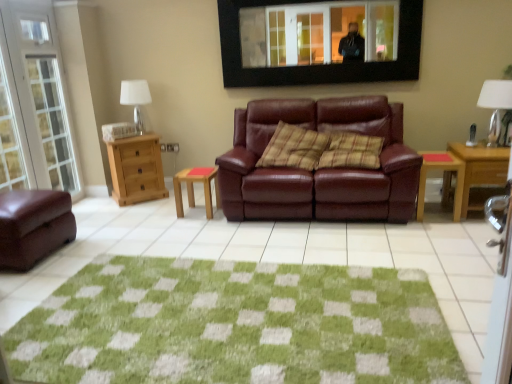
The height and width of the screenshot is (384, 512). Describe the element at coordinates (320, 169) in the screenshot. I see `matte leather couch at center, acting as the second studio couch starting from the left` at that location.

This screenshot has height=384, width=512. In order to click on wooden desk at right in this screenshot , I will do `click(480, 168)`.

Describe the element at coordinates (445, 172) in the screenshot. Image resolution: width=512 pixels, height=384 pixels. I see `wooden side table at right, the 2th table viewed from the left` at that location.

Measure the distance between point (26,245) and camera.

9.72 feet.

Where is `white fabric lampshade at upper right, the first lamp when ordered from right to left`? This screenshot has width=512, height=384. white fabric lampshade at upper right, the first lamp when ordered from right to left is located at coordinates (495, 104).

The height and width of the screenshot is (384, 512). I want to click on matte leather couch at center, which is the first studio couch from right to left, so click(x=320, y=169).

Measure the distance from white fabric lampshade at left, the second lamp viewed from the right, to wooden side table at right, the 2th table viewed from the left.

white fabric lampshade at left, the second lamp viewed from the right, and wooden side table at right, the 2th table viewed from the left, are 2.88 meters apart from each other.

From the image's perspective, starting from the white fabric lampshade at left, which is the first lamp from left to right, which table is the 1st one below? Please provide its 2D coordinates.

[(445, 172)]

From the image's perspective, would you say white fabric lampshade at left, arranged as the 1th lamp when viewed from the back, is positioned over wooden side table at right, which is counted as the 1th table, starting from the right?

Yes.

Looking at this image, from a real-world perspective, which object rests below the other?

wooden side table at right, the 2th table viewed from the left.

Which object is positioned more to the right, matte leather couch at center, acting as the second studio couch starting from the left, or matte brown leather ottoman at lower left, which appears as the first studio couch when viewed from the left?

matte leather couch at center, acting as the second studio couch starting from the left, is more to the right.

Consider the image. From the image's perspective, which one is positioned higher, matte leather couch at center, acting as the second studio couch starting from the left, or matte brown leather ottoman at lower left, which appears as the first studio couch when viewed from the left?

From the image's view, matte leather couch at center, acting as the second studio couch starting from the left, is above.

Between matte leather couch at center, which is the first studio couch from right to left, and matte brown leather ottoman at lower left, which appears as the first studio couch when viewed from the left, which one has less height?

With less height is matte brown leather ottoman at lower left, which appears as the first studio couch when viewed from the left.

From the picture: Considering the relative sizes of matte leather couch at center, which is the first studio couch from right to left, and matte brown leather ottoman at lower left, which appears as the first studio couch when viewed from the left, in the image provided, is matte leather couch at center, which is the first studio couch from right to left, smaller than matte brown leather ottoman at lower left, which appears as the first studio couch when viewed from the left,?

Actually, matte leather couch at center, which is the first studio couch from right to left, might be larger than matte brown leather ottoman at lower left, which appears as the first studio couch when viewed from the left.

In terms of height, does matte leather couch at center, acting as the second studio couch starting from the left, look taller or shorter compared to plaid fabric pillow at center?

Considering their sizes, matte leather couch at center, acting as the second studio couch starting from the left, has more height than plaid fabric pillow at center.

From the image's perspective, count 1st studio couchs downward from the plaid fabric pillow at center and point to it. Please provide its 2D coordinates.

[(320, 169)]

Between matte leather couch at center, which is the first studio couch from right to left, and plaid fabric pillow at center, which one appears on the right side from the viewer's perspective?

From the viewer's perspective, matte leather couch at center, which is the first studio couch from right to left, appears more on the right side.

Is matte leather couch at center, which is the first studio couch from right to left, oriented away from plaid fabric pillow at center?

Yes.

Which is in front, wooden stool at center, marked as the first table in a left-to-right arrangement, or matte brown leather ottoman at lower left, which appears as the first studio couch when viewed from the left?

matte brown leather ottoman at lower left, which appears as the first studio couch when viewed from the left, is in front.

Can we say wooden stool at center, the second table from the right, lies outside matte brown leather ottoman at lower left, arranged as the second studio couch when viewed from the right?

Yes, wooden stool at center, the second table from the right, is located beyond the bounds of matte brown leather ottoman at lower left, arranged as the second studio couch when viewed from the right.

Is wooden stool at center, marked as the first table in a left-to-right arrangement, far away from matte brown leather ottoman at lower left, arranged as the second studio couch when viewed from the right?

wooden stool at center, marked as the first table in a left-to-right arrangement, is far away from matte brown leather ottoman at lower left, arranged as the second studio couch when viewed from the right.

Is white fabric lampshade at upper right, the 1th lamp viewed from the front, positioned with its back to wooden stool at center, marked as the first table in a left-to-right arrangement?

No, wooden stool at center, marked as the first table in a left-to-right arrangement, is not at the back of white fabric lampshade at upper right, the 1th lamp viewed from the front.

Is white fabric lampshade at upper right, the 1th lamp viewed from the front, touching wooden stool at center, the second table from the right?

No, white fabric lampshade at upper right, the 1th lamp viewed from the front, is not making contact with wooden stool at center, the second table from the right.

Considering the relative sizes of white fabric lampshade at upper right, which appears as the 2th lamp when viewed from the back, and wooden stool at center, marked as the first table in a left-to-right arrangement, in the image provided, is white fabric lampshade at upper right, which appears as the 2th lamp when viewed from the back, wider than wooden stool at center, marked as the first table in a left-to-right arrangement,?

In fact, white fabric lampshade at upper right, which appears as the 2th lamp when viewed from the back, might be narrower than wooden stool at center, marked as the first table in a left-to-right arrangement.

Based on the photo, how different are the orientations of wooden desk at right and wooden side table at right, the 2th table viewed from the left, in degrees?

The angular difference between wooden desk at right and wooden side table at right, the 2th table viewed from the left, is 1.08 degrees.

Choose the correct answer: Is wooden desk at right inside wooden side table at right, which is counted as the 1th table, starting from the right, or outside it?

wooden desk at right is outside wooden side table at right, which is counted as the 1th table, starting from the right.

Which point is more forward, (507, 158) or (424, 157)?

The point (507, 158) is closer to the camera.

You are a GUI agent. You are given a task and a screenshot of the screen. Output one action in this format:
    pyautogui.click(x=<x>, y=<y>)
    Task: Click on the desk above the wooden side table at right, the 2th table viewed from the left (from the image's perspective)
    This screenshot has width=512, height=384.
    Given the screenshot: What is the action you would take?
    pyautogui.click(x=480, y=168)

Between matte leather couch at center, which is the first studio couch from right to left, and wooden desk at right, which one is positioned in front?

matte leather couch at center, which is the first studio couch from right to left, is closer to the camera.

Between matte leather couch at center, which is the first studio couch from right to left, and wooden desk at right, which one appears on the left side from the viewer's perspective?

From the viewer's perspective, matte leather couch at center, which is the first studio couch from right to left, appears more on the left side.

Are matte leather couch at center, which is the first studio couch from right to left, and wooden desk at right far apart?

No, matte leather couch at center, which is the first studio couch from right to left, is not far away from wooden desk at right.

Consider the image. Is matte leather couch at center, acting as the second studio couch starting from the left, wider than wooden desk at right?

Yes.

From a real-world perspective, which table is the 1st one underneath the white fabric lampshade at left, arranged as the 1th lamp when viewed from the back? Please provide its 2D coordinates.

[(445, 172)]

Where is `studio couch above the matte brown leather ottoman at lower left, arranged as the second studio couch when viewed from the right (from a real-world perspective)`? studio couch above the matte brown leather ottoman at lower left, arranged as the second studio couch when viewed from the right (from a real-world perspective) is located at coordinates (320, 169).

Considering their positions, is wooden desk at right positioned closer to white fabric lampshade at upper right, the first lamp when ordered from right to left, than matte leather couch at center, which is the first studio couch from right to left?

Among the two, wooden desk at right is located nearer to white fabric lampshade at upper right, the first lamp when ordered from right to left.

Looking at the image, which one is located closer to white fabric lampshade at left, arranged as the 1th lamp when viewed from the back, wooden dresser at left or matte leather couch at center, acting as the second studio couch starting from the left?

wooden dresser at left.

Based on their spatial positions, is black framed mirror at upper center or matte leather couch at center, acting as the second studio couch starting from the left, closer to green textured rug at center?

The object closer to green textured rug at center is matte leather couch at center, acting as the second studio couch starting from the left.

Estimate the real-world distances between objects in this image. Which object is further from matte leather couch at center, which is the first studio couch from right to left, matte brown leather ottoman at lower left, which appears as the first studio couch when viewed from the left, or wooden stool at center, the second table from the right?

matte brown leather ottoman at lower left, which appears as the first studio couch when viewed from the left, is further to matte leather couch at center, which is the first studio couch from right to left.

Considering their positions, is green textured rug at center positioned closer to matte leather couch at center, which is the first studio couch from right to left, than wooden desk at right?

wooden desk at right is positioned closer to the anchor matte leather couch at center, which is the first studio couch from right to left.

Which object lies further to the anchor point wooden stool at center, marked as the first table in a left-to-right arrangement, white fabric lampshade at left, which is the first lamp from left to right, or wooden desk at right?

Based on the image, wooden desk at right appears to be further to wooden stool at center, marked as the first table in a left-to-right arrangement.

From the image, which object appears to be farther from wooden desk at right, white fabric lampshade at upper right, the 1th lamp viewed from the front, or matte leather couch at center, acting as the second studio couch starting from the left?

Based on the image, matte leather couch at center, acting as the second studio couch starting from the left, appears to be further to wooden desk at right.

Estimate the real-world distances between objects in this image. Which object is closer to wooden desk at right, plaid fabric pillow at center or matte leather couch at center, which is the first studio couch from right to left?

Based on the image, matte leather couch at center, which is the first studio couch from right to left, appears to be nearer to wooden desk at right.

Where is `doormat between matte brown leather ottoman at lower left, arranged as the second studio couch when viewed from the right, and white fabric lampshade at upper right, which appears as the 2th lamp when viewed from the back, from left to right`? The width and height of the screenshot is (512, 384). doormat between matte brown leather ottoman at lower left, arranged as the second studio couch when viewed from the right, and white fabric lampshade at upper right, which appears as the 2th lamp when viewed from the back, from left to right is located at coordinates (234, 325).

At what (x,y) coordinates should I click in order to perform the action: click on doormat between wooden dresser at left and wooden side table at right, the 2th table viewed from the left, in the horizontal direction. Please return your answer as a coordinate pair (x, y). The height and width of the screenshot is (384, 512). Looking at the image, I should click on pos(234,325).

Where is `studio couch between wooden stool at center, marked as the first table in a left-to-right arrangement, and white fabric lampshade at upper right, the first lamp when ordered from right to left`? The width and height of the screenshot is (512, 384). studio couch between wooden stool at center, marked as the first table in a left-to-right arrangement, and white fabric lampshade at upper right, the first lamp when ordered from right to left is located at coordinates (320, 169).

The height and width of the screenshot is (384, 512). I want to click on studio couch between matte brown leather ottoman at lower left, which appears as the first studio couch when viewed from the left, and wooden side table at right, the 2th table viewed from the left, from left to right, so click(x=320, y=169).